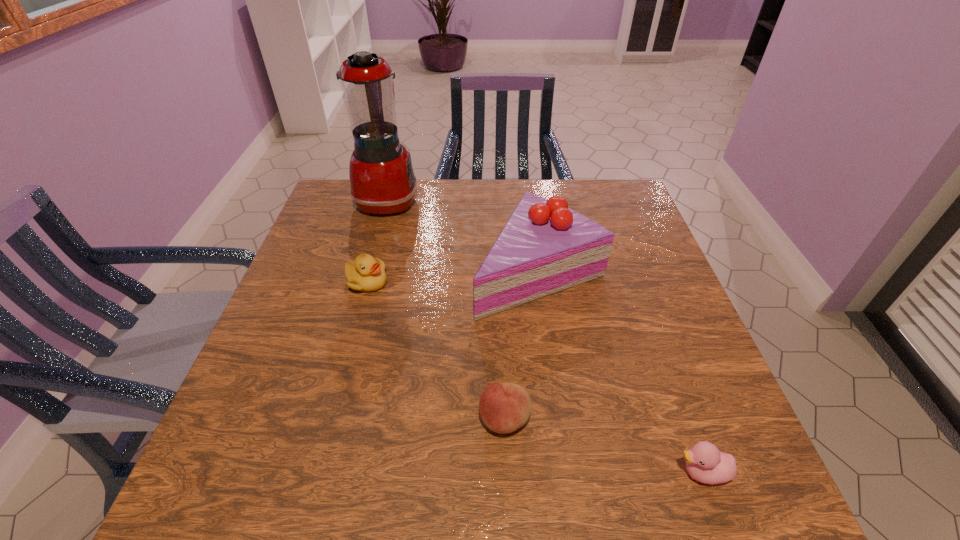
Image resolution: width=960 pixels, height=540 pixels. In order to click on the tallest object in this screenshot , I will do pyautogui.click(x=382, y=179).

Image resolution: width=960 pixels, height=540 pixels. In order to click on the farthest object in this screenshot , I will do `click(382, 179)`.

Where is `cake`? This screenshot has width=960, height=540. cake is located at coordinates (545, 247).

I want to click on the farther duckling, so click(x=366, y=274).

You are a GUI agent. You are given a task and a screenshot of the screen. Output one action in this format:
    pyautogui.click(x=<x>, y=<y>)
    Task: Click on the second nearest object
    The image size is (960, 540).
    Given the screenshot: What is the action you would take?
    pyautogui.click(x=504, y=407)

This screenshot has width=960, height=540. I want to click on the nearest object, so click(x=705, y=463).

Where is `the nearer duckling`? the nearer duckling is located at coordinates (705, 463).

At what (x,y) coordinates should I click in order to perform the action: click on free space located 0.080m on the controls of the farthest object. Please return your answer as a coordinate pair (x, y). This screenshot has width=960, height=540. Looking at the image, I should click on (444, 201).

Locate an element on the screen. This screenshot has width=960, height=540. free space located on the back of the fourth shortest object is located at coordinates (530, 208).

At what (x,y) coordinates should I click in order to perform the action: click on vacant area located on the front-facing side of the farther duckling. Please return your answer as a coordinate pair (x, y). This screenshot has width=960, height=540. Looking at the image, I should click on (412, 281).